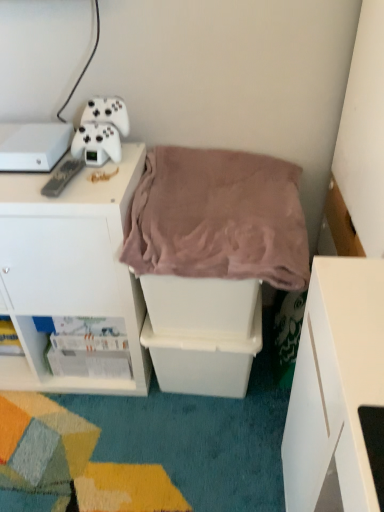
What are the coordinates of `vacant space positioned to the left of black plastic remote at upper left` in the screenshot? It's located at (24, 185).